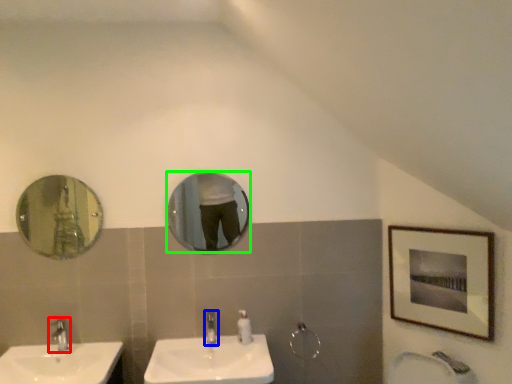
Question: Estimate the real-world distances between objects in this image. Which object is closer to tap (highlighted by a red box), tap (highlighted by a blue box) or mirror (highlighted by a green box)?

Choices:
 (A) tap
 (B) mirror

Answer: (A)